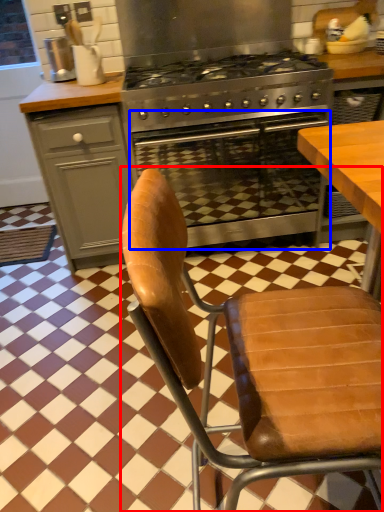
Question: Which object is further to the camera taking this photo, chair (highlighted by a red box) or oven (highlighted by a blue box)?

Choices:
 (A) chair
 (B) oven

Answer: (B)